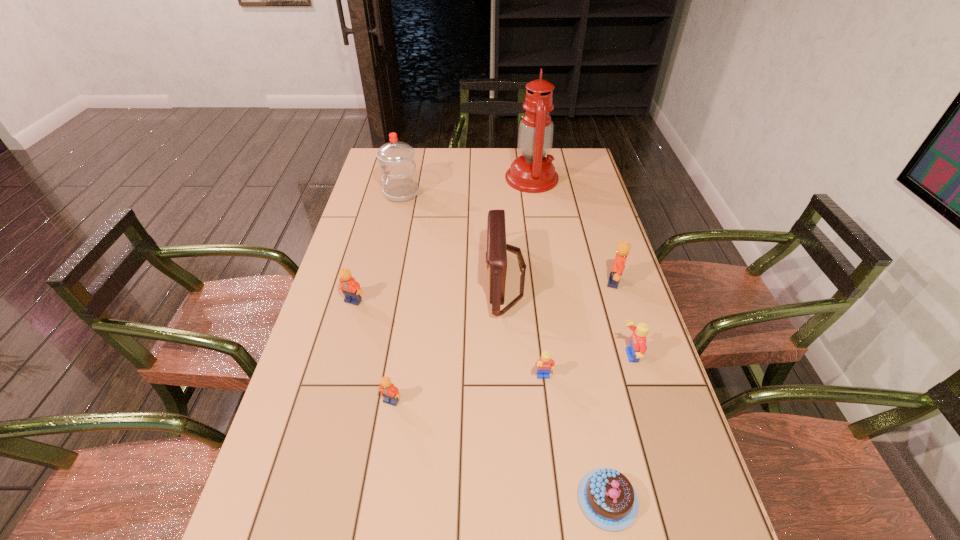
The width and height of the screenshot is (960, 540). What are the coordinates of `the nearest orange Lego` in the screenshot? It's located at (391, 394).

You are a GUI agent. You are given a task and a screenshot of the screen. Output one action in this format:
    pyautogui.click(x=<x>, y=<y>)
    Task: Click on the fourth Lego from right to left
    
    Given the screenshot: What is the action you would take?
    pyautogui.click(x=391, y=394)

Identify the location of the fourth farthest Lego. (545, 364).

Where is `the nearer yellow Lego`? The height and width of the screenshot is (540, 960). the nearer yellow Lego is located at coordinates (545, 364).

Where is `the nearest object`? the nearest object is located at coordinates (607, 498).

Where is `chocolate cake`? The height and width of the screenshot is (540, 960). chocolate cake is located at coordinates (607, 498).

The width and height of the screenshot is (960, 540). Identify the location of vacant space located 0.110m on the front of the tallest object. click(x=537, y=212).

At what (x,y) coordinates should I click in order to perform the action: click on vacant area situated 0.050m on the handle side of the eighth shortest object. Please return your answer as a coordinate pair (x, y). Looking at the image, I should click on (370, 193).

Locate an element on the screen. vacant space located on the handle side of the eighth shortest object is located at coordinates (365, 193).

The width and height of the screenshot is (960, 540). Find the location of `free space located on the front flap of the shoulder bag`. free space located on the front flap of the shoulder bag is located at coordinates (362, 277).